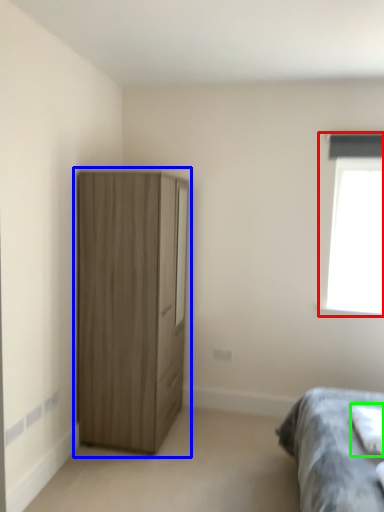
Question: Considering the real-world distances, which object is closest to window (highlighted by a red box)? cupboard (highlighted by a blue box) or sheet (highlighted by a green box).

Choices:
 (A) cupboard
 (B) sheet

Answer: (B)